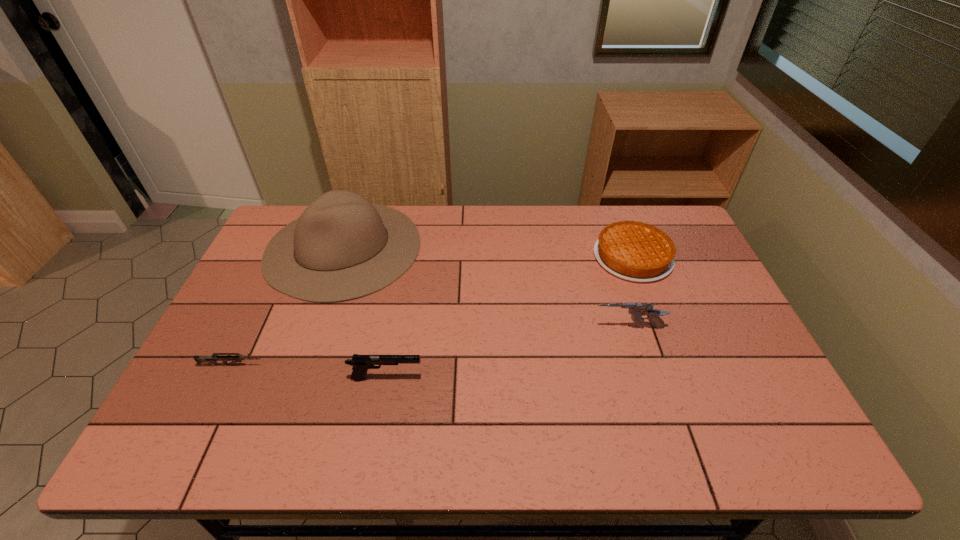
You are a GUI agent. You are given a task and a screenshot of the screen. Output one action in this format:
    pyautogui.click(x=<x>, y=<y>)
    Task: Click on the free space between the farthest gun and the nearest object
    This screenshot has height=540, width=960.
    Given the screenshot: What is the action you would take?
    pyautogui.click(x=507, y=353)

I want to click on empty space that is in between the farthest gun and the shortest object, so click(430, 347).

Locate an element on the screen. This screenshot has width=960, height=540. vacant point located between the second gun from left to right and the rightmost gun is located at coordinates (507, 353).

Locate an element on the screen. unoccupied position between the third farthest object and the second gun from left to right is located at coordinates (507, 353).

At what (x,y) coordinates should I click in order to perform the action: click on vacant space that's between the pie and the farthest gun. Please return your answer as a coordinate pair (x, y). Looking at the image, I should click on (631, 293).

The image size is (960, 540). What are the coordinates of `vacant region between the tallest object and the fourth farthest object` in the screenshot? It's located at (288, 307).

Locate an element on the screen. This screenshot has height=540, width=960. free space between the second gun from right to left and the third nearest object is located at coordinates (507, 353).

Identify which object is the third closest to the sombrero. Please provide its 2D coordinates. Your answer should be formatted as a tuple, i.e. [(x, y)], where the tuple contains the x and y coordinates of a point satisfying the conditions above.

[(637, 309)]

You are a GUI agent. You are given a task and a screenshot of the screen. Output one action in this format:
    pyautogui.click(x=<x>, y=<y>)
    Task: Click on the third closest object to the third nearest object
    This screenshot has height=540, width=960.
    Given the screenshot: What is the action you would take?
    pyautogui.click(x=347, y=248)

Locate an element on the screen. the closest gun to the shortest gun is located at coordinates (361, 363).